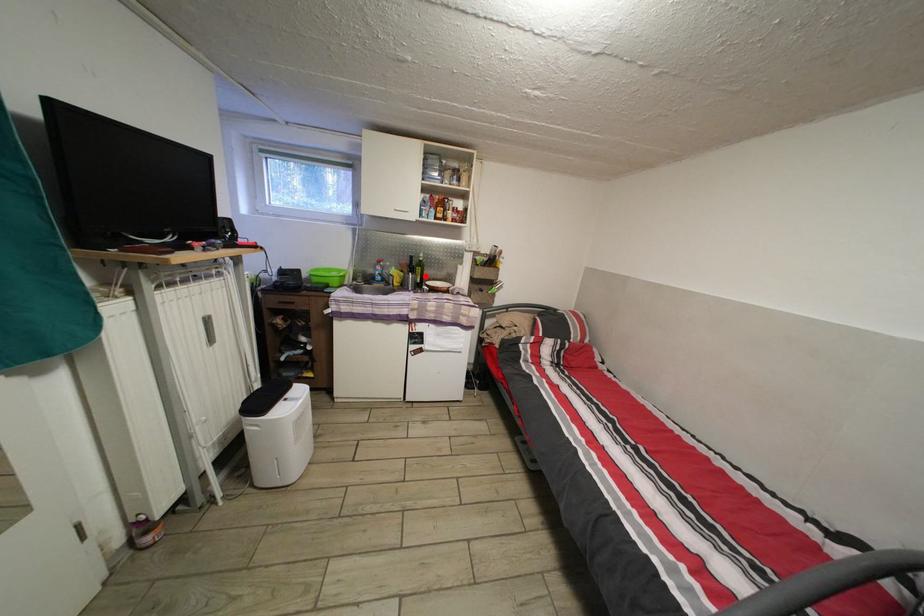
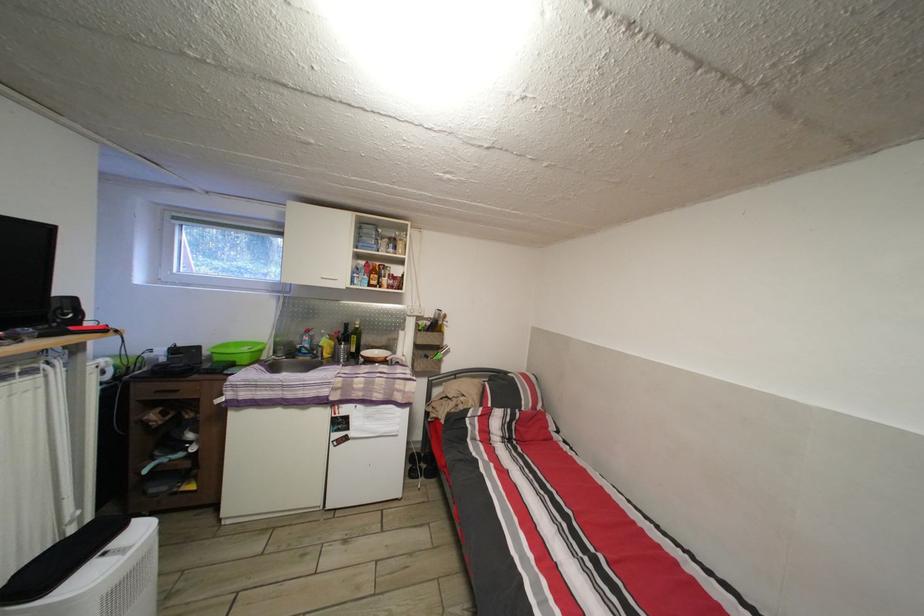
Question: I am providing you with two images of the same scene from different viewpoints. A red point is marked on the first image. At the location where the point appears in image 1, is it still visible in image 2?

Choices:
 (A) Yes
 (B) No

Answer: (A)